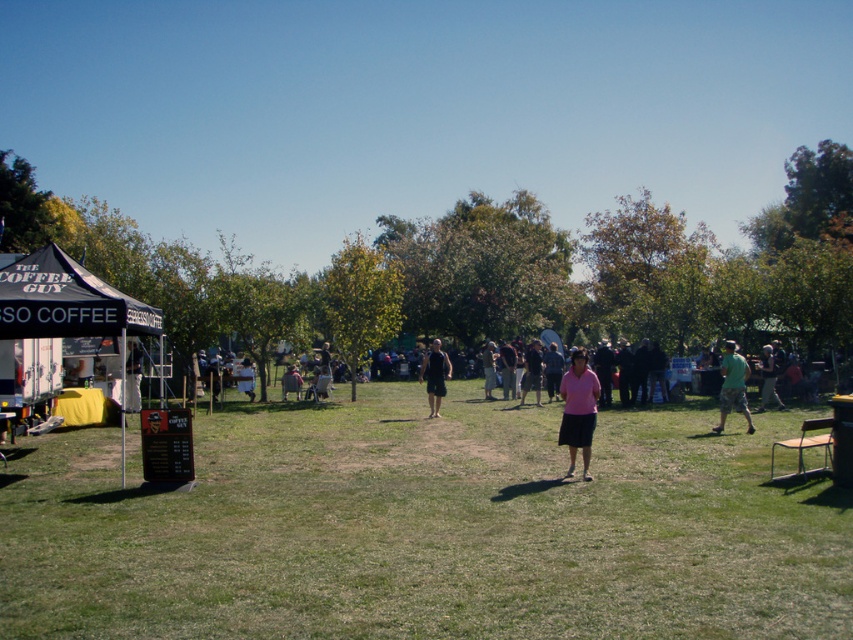
You are planning to sit on the light brown wooden chair at center. Is the green fabric shirt at center in your way? Please explain.

The green fabric shirt at center has a smaller size compared to the light brown wooden chair at center. Since the shirt is smaller, it might not obstruct the chair, but its exact position isn wait in the description, so we cannot be certain.

You are standing at the entrance of the park and see two points marked in the image. The first point is labeled as point (149, 326) and the second is point (433, 376). Which point is closer to you?

Point (149, 326) is in front of point (433, 376), so it is closer to you.